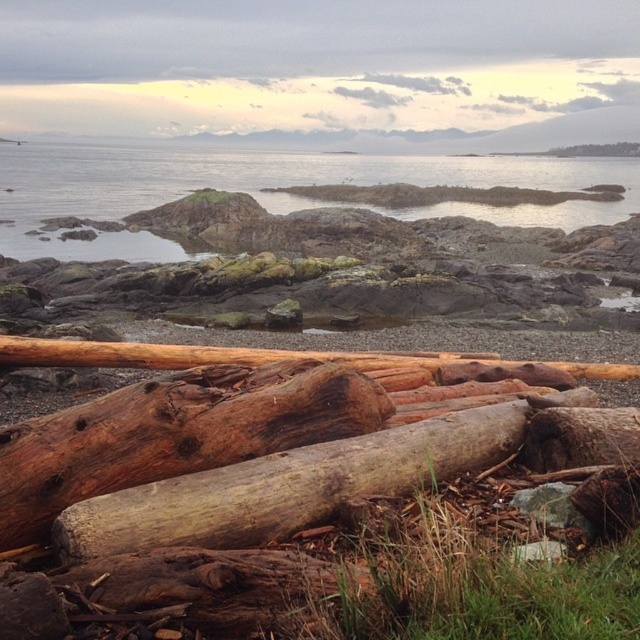
Who is positioned more to the left, clear water at center or brown rough wood at center?

clear water at center is more to the left.

Can you confirm if clear water at center is positioned to the right of brown rough wood at center?

No, clear water at center is not to the right of brown rough wood at center.

Who is more forward, [580,209] or [420,429]?

Positioned in front is point [420,429].

Where is `clear water at center`? The width and height of the screenshot is (640, 640). clear water at center is located at coordinates (268, 192).

Is brown rough wood at center to the left of brown rough wood at upper right from the viewer's perspective?

Correct, you'll find brown rough wood at center to the left of brown rough wood at upper right.

Is brown rough wood at center thinner than brown rough wood at upper right?

No, brown rough wood at center is not thinner than brown rough wood at upper right.

Is point (189, 528) closer to camera compared to point (616, 152)?

That is True.

This screenshot has width=640, height=640. Find the location of `brown rough wood at center`. brown rough wood at center is located at coordinates (285, 486).

Is clear water at center smaller than brown rough wood at upper right?

Incorrect, clear water at center is not smaller in size than brown rough wood at upper right.

Is clear water at center wider than brown rough wood at upper right?

Yes.

Who is more forward, (x=140, y=164) or (x=548, y=150)?

Point (x=140, y=164) is more forward.

Locate an element on the screen. clear water at center is located at coordinates (268, 192).